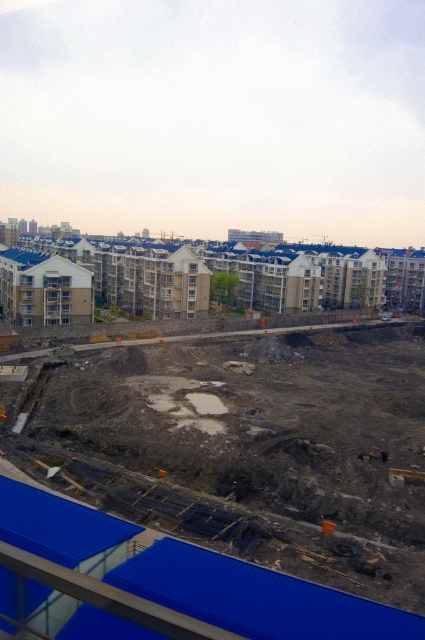
Question: From the image, what is the correct spatial relationship of dull gray concrete at center in relation to white concrete buildings at upper center?

Choices:
 (A) left
 (B) right

Answer: (B)

Question: Is dull gray concrete at center wider than white concrete buildings at upper center?

Choices:
 (A) yes
 (B) no

Answer: (B)

Question: Among these points, which one is nearest to the camera?

Choices:
 (A) (294, 280)
 (B) (410, 422)

Answer: (B)

Question: Is dull gray concrete at center smaller than white concrete buildings at upper center?

Choices:
 (A) no
 (B) yes

Answer: (B)